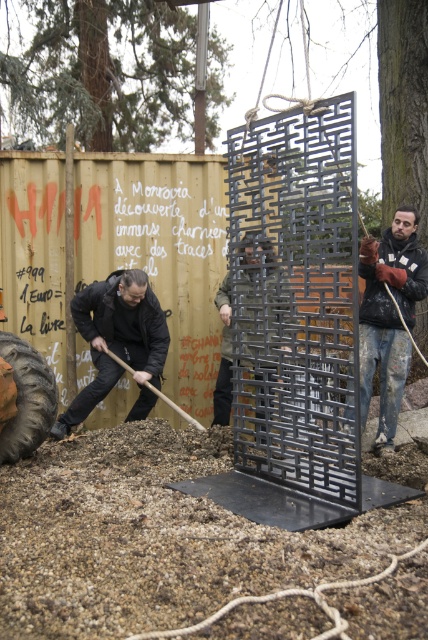
Question: Which of these objects is positioned farthest from the smooth wooden shovel at lower center?

Choices:
 (A) painted denim jacket at right
 (B) metallic grid at center
 (C) black matte jacket at lower left

Answer: (A)

Question: Which object is the closest to the smooth wooden shovel at lower center?

Choices:
 (A) metallic grid at center
 (B) black matte jacket at lower left

Answer: (B)

Question: Observing the image, what is the correct spatial positioning of painted denim jacket at right in reference to metallic grid at center?

Choices:
 (A) right
 (B) left

Answer: (A)

Question: Is black matte jacket at lower left to the right of metallic grid at center from the viewer's perspective?

Choices:
 (A) no
 (B) yes

Answer: (A)

Question: Which point is farther to the camera?

Choices:
 (A) smooth wooden shovel at lower center
 (B) black matte jacket at lower left

Answer: (A)

Question: Is black matte jacket at lower left further to the viewer compared to dark gray rubber tire at lower left?

Choices:
 (A) no
 (B) yes

Answer: (B)